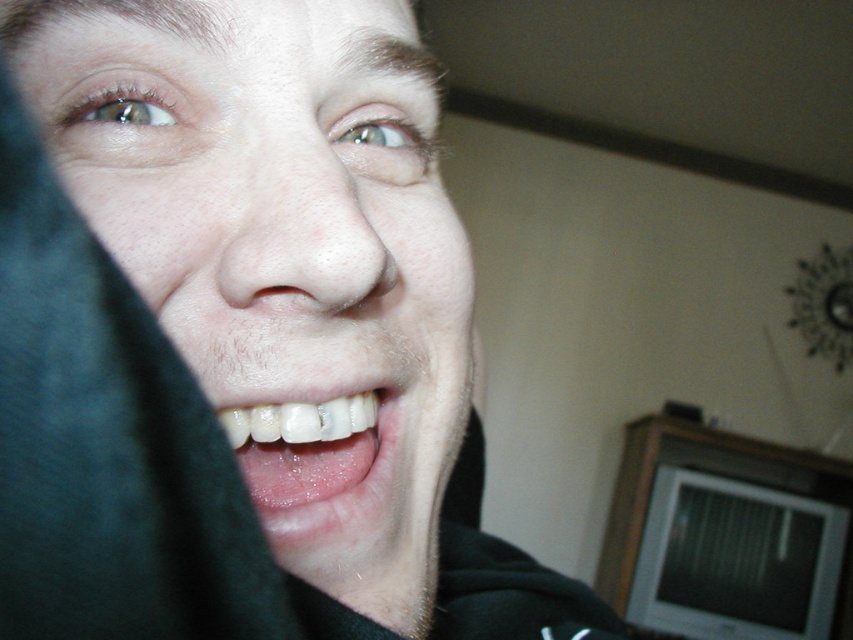
Question: Which object appears closest to the camera in this image?

Choices:
 (A) matte black face at center
 (B) white glossy teeth at center

Answer: (A)

Question: Is matte black face at center above white glossy teeth at center?

Choices:
 (A) no
 (B) yes

Answer: (B)

Question: Where is matte black face at center located in relation to white glossy teeth at center in the image?

Choices:
 (A) left
 (B) right

Answer: (B)

Question: Does matte black face at center have a smaller size compared to white glossy teeth at center?

Choices:
 (A) no
 (B) yes

Answer: (A)

Question: Which point is closer to the camera taking this photo?

Choices:
 (A) coord(268,467)
 (B) coord(250,294)

Answer: (B)